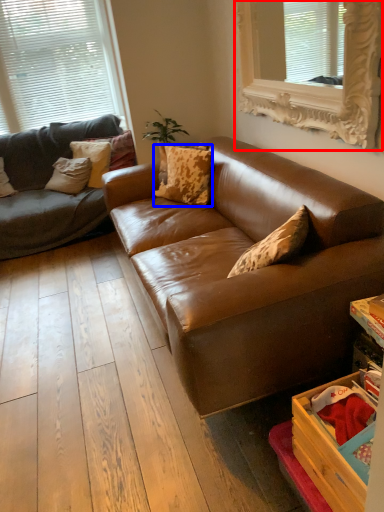
Question: Which of the following is the farthest to the observer, window (highlighted by a red box) or pillow (highlighted by a blue box)?

Choices:
 (A) window
 (B) pillow

Answer: (B)